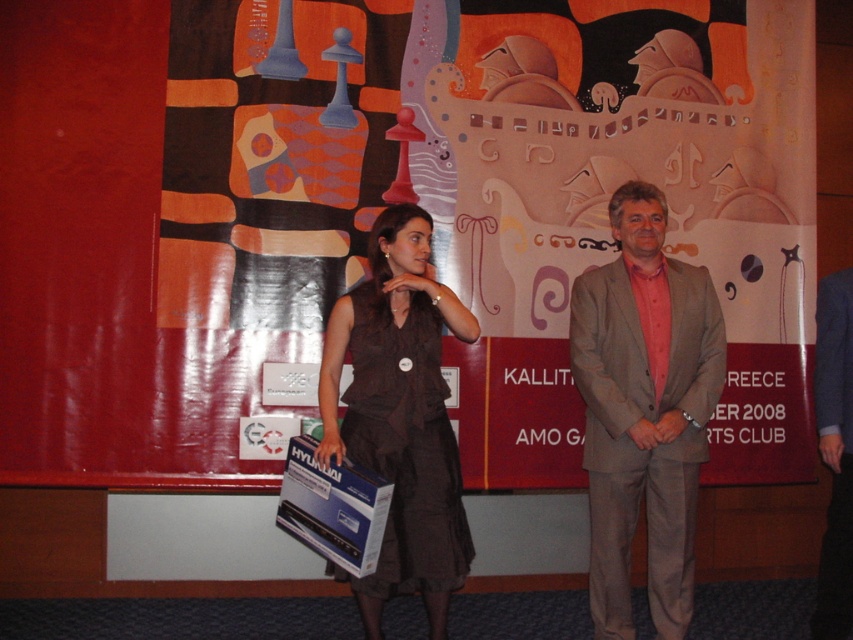
Question: Can you confirm if matte cardboard poster at center is smaller than light brown suit at center?

Choices:
 (A) yes
 (B) no

Answer: (B)

Question: Which object appears closest to the camera in this image?

Choices:
 (A) light brown suit at center
 (B) gray fabric suit at center
 (C) brown fabric dress at center
 (D) matte cardboard poster at center

Answer: (C)

Question: Where is matte cardboard poster at center located in relation to light brown suit at center in the image?

Choices:
 (A) right
 (B) left

Answer: (B)

Question: Is matte cardboard poster at center to the right of brown fabric dress at center from the viewer's perspective?

Choices:
 (A) no
 (B) yes

Answer: (B)

Question: Among these points, which one is farthest from the camera?

Choices:
 (A) (447, 417)
 (B) (564, 161)

Answer: (B)

Question: Which object is the farthest from the gray fabric suit at center?

Choices:
 (A) brown fabric dress at center
 (B) matte cardboard poster at center

Answer: (B)